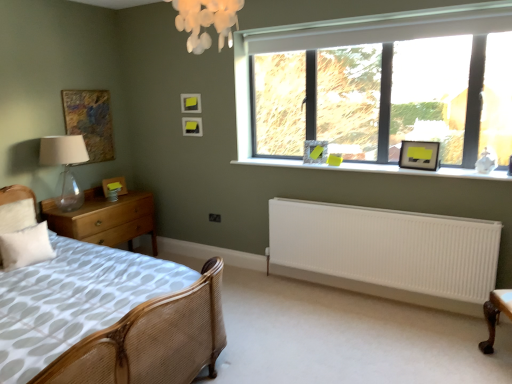
Locate an element on the screen. This screenshot has height=384, width=512. free location to the left of matte black picture frame at upper right, the sixth picture frame when ordered from left to right is located at coordinates (400, 170).